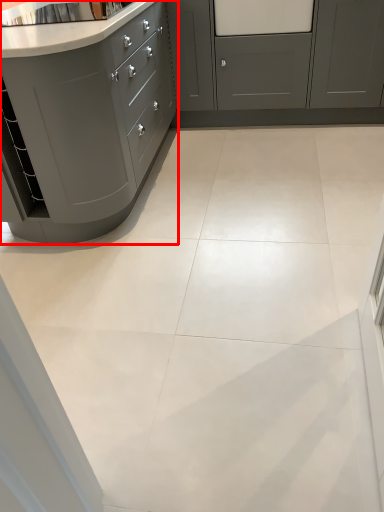
Question: From the image, what is the correct spatial relationship of cabinetry (annotated by the red box) in relation to cabinetry?

Choices:
 (A) left
 (B) right

Answer: (A)